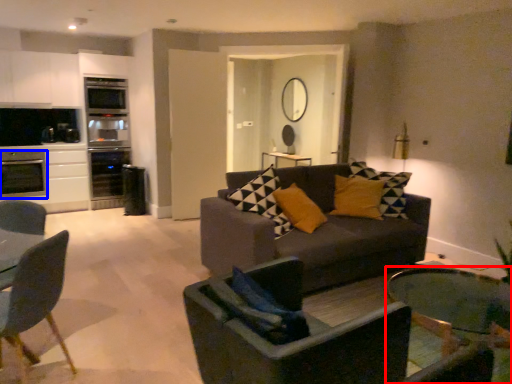
Question: Which object is closer to the camera taking this photo, coffee table (highlighted by a red box) or appliance (highlighted by a blue box)?

Choices:
 (A) coffee table
 (B) appliance

Answer: (A)